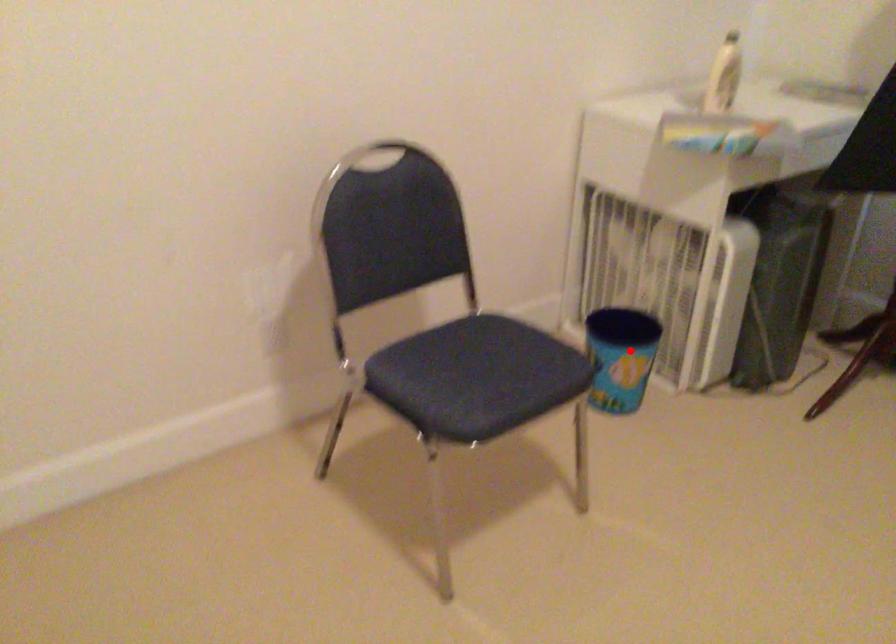
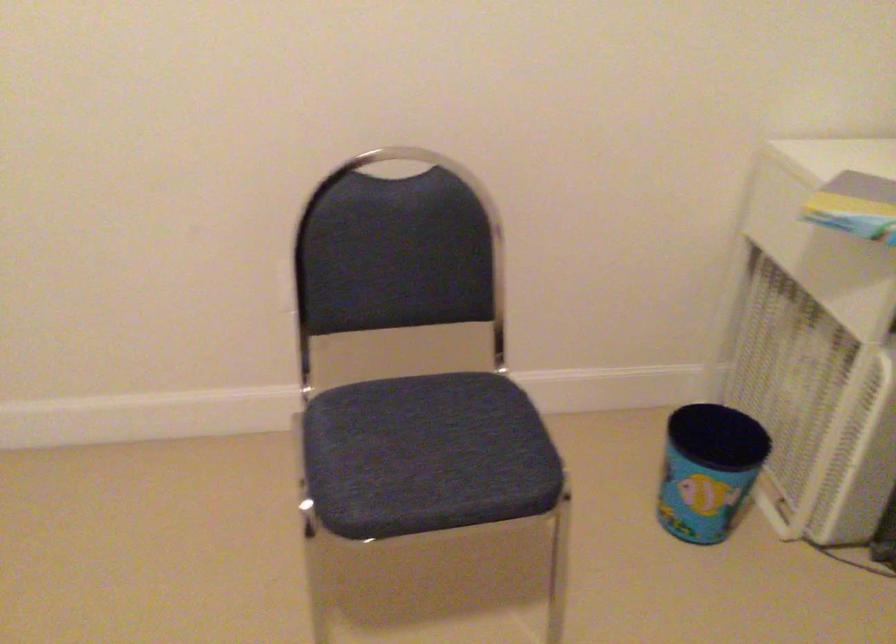
Locate, in the second image, the point that corresponds to the highlighted location in the first image.

(708, 469)